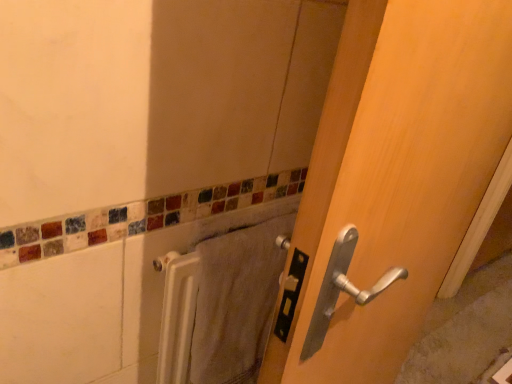
Question: From a real-world perspective, is white textured towel at lower center positioned above or below wooden door at center?

Choices:
 (A) below
 (B) above

Answer: (A)

Question: Is white textured towel at lower center inside or outside of wooden door at center?

Choices:
 (A) outside
 (B) inside

Answer: (A)

Question: Is white textured towel at lower center wider or thinner than wooden door at center?

Choices:
 (A) wide
 (B) thin

Answer: (B)

Question: From a real-world perspective, is wooden door at center physically located above or below white textured towel at lower center?

Choices:
 (A) below
 (B) above

Answer: (B)

Question: Is wooden door at center inside or outside of white textured towel at lower center?

Choices:
 (A) inside
 (B) outside

Answer: (B)

Question: From the image's perspective, is wooden door at center above or below white textured towel at lower center?

Choices:
 (A) above
 (B) below

Answer: (A)

Question: In terms of width, does wooden door at center look wider or thinner when compared to white textured towel at lower center?

Choices:
 (A) thin
 (B) wide

Answer: (B)